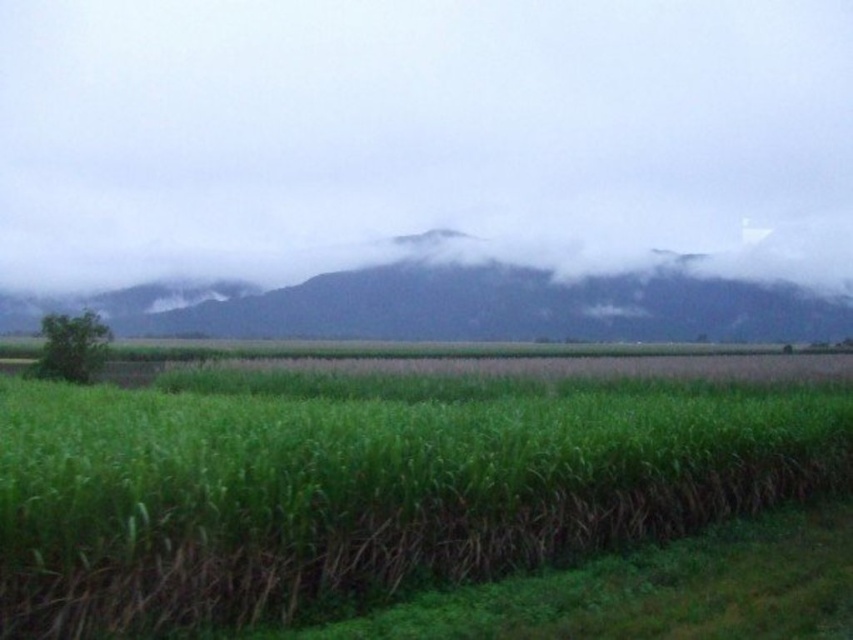
You are a farmer who wants to plant new crops in the green grassy corn field at center. However, there is a green grassy field at upper center above it. Which field should you prioritize planting first based on their positions?

You should prioritize planting the green grassy corn field at center first because it is positioned under the green grassy field at upper center, meaning it is lower in elevation and might be more accessible or suitable for planting.